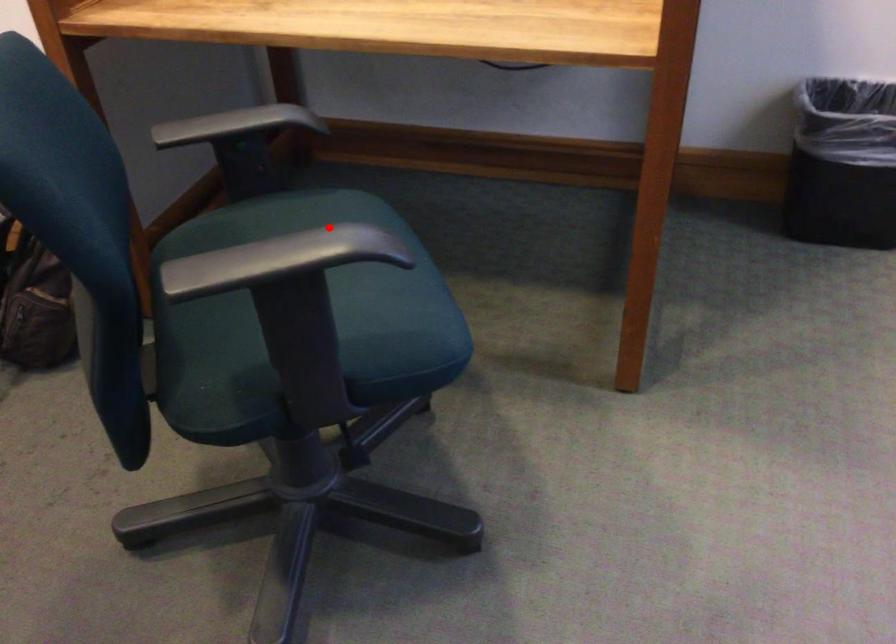
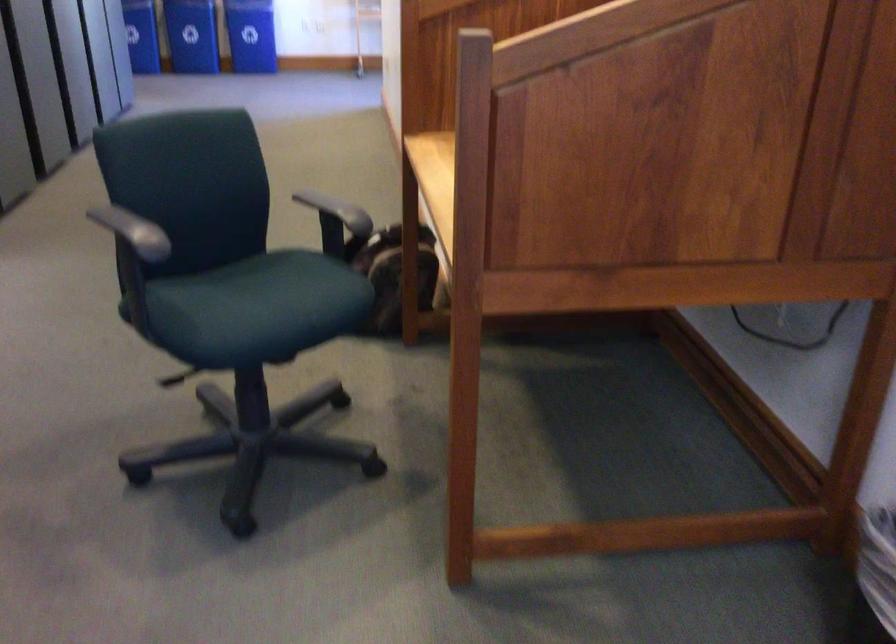
Question: I am providing you with two images of the same scene from different viewpoints. A red point is shown in image1. For the corresponding object point in image2, is it positioned nearer or farther from the camera?

Choices:
 (A) Nearer
 (B) Farther

Answer: (B)